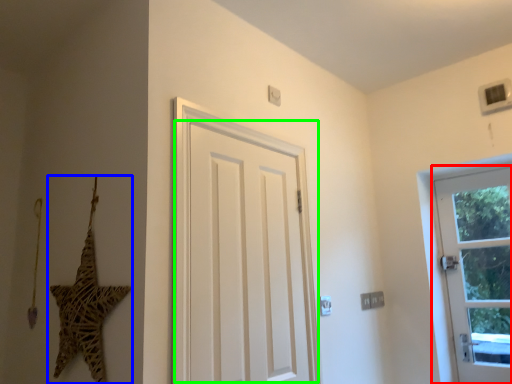
Question: Considering the real-world distances, which object is closest to door (highlighted by a red box)? star (highlighted by a blue box) or door (highlighted by a green box).

Choices:
 (A) star
 (B) door

Answer: (B)